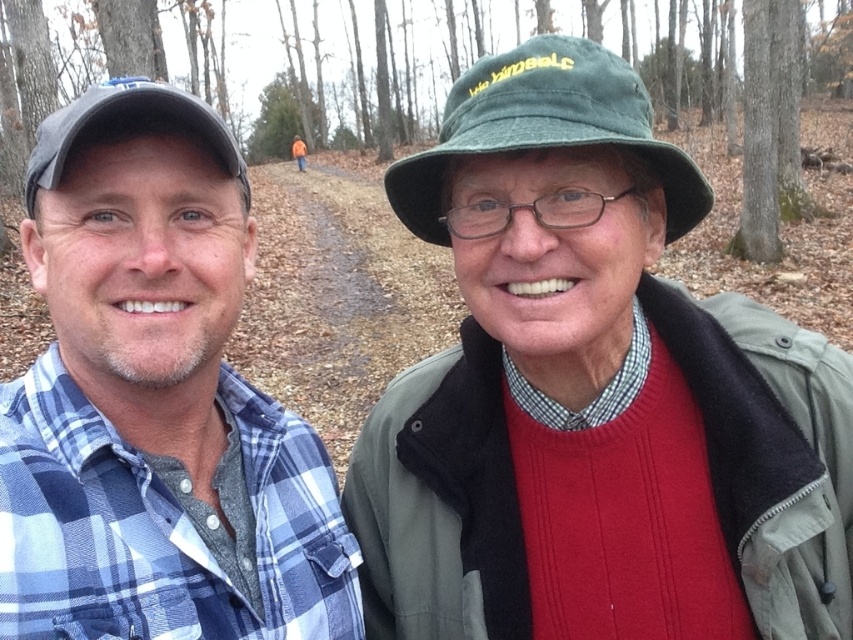
Question: From the image, what is the correct spatial relationship of blue plaid shirt at left in relation to matte gray cap at left?

Choices:
 (A) left
 (B) right

Answer: (B)

Question: Does blue plaid shirt at left appear on the left side of green fabric hat at center?

Choices:
 (A) no
 (B) yes

Answer: (B)

Question: Which point is farther to the camera?

Choices:
 (A) blue plaid shirt at left
 (B) green fabric hat at center
 (C) matte gray cap at left

Answer: (B)

Question: Which object is the farthest from the green fabric hat at center?

Choices:
 (A) blue plaid shirt at left
 (B) matte gray cap at left

Answer: (B)

Question: Which point is closer to the camera taking this photo?

Choices:
 (A) (451, 109)
 (B) (100, 262)
 (C) (120, 106)

Answer: (C)

Question: Is blue plaid shirt at left in front of matte gray cap at left?

Choices:
 (A) yes
 (B) no

Answer: (A)